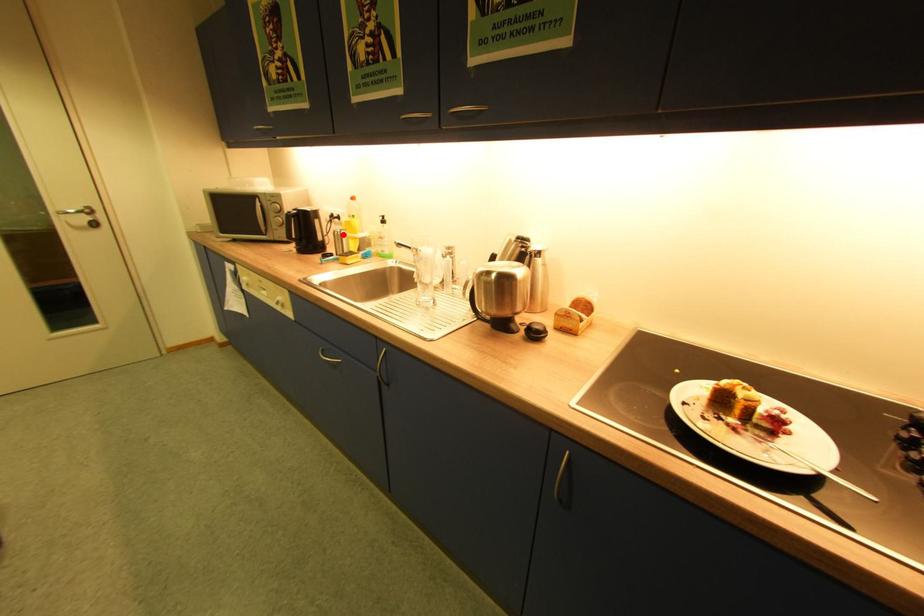
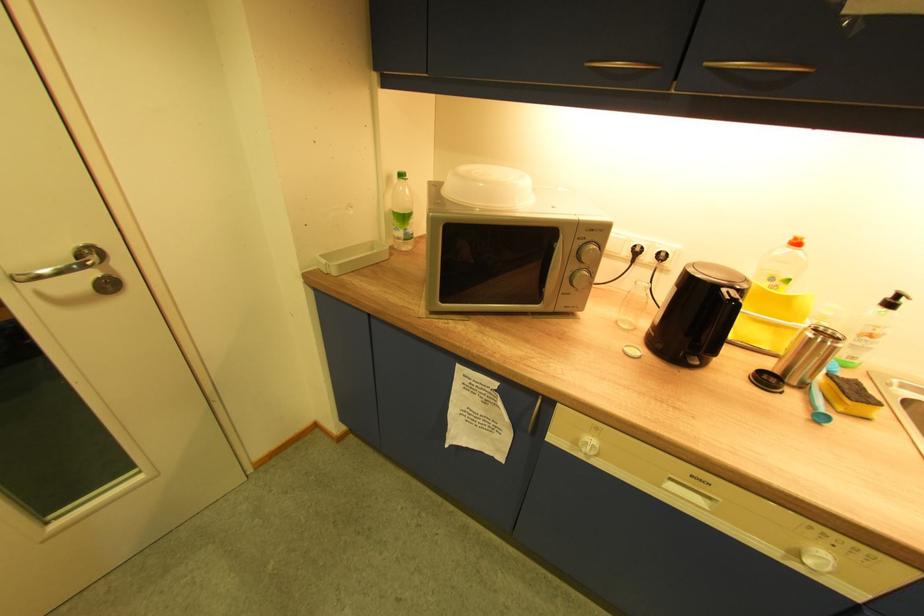
Find the pixel in the second image that matches the highlighted location in the first image.

(830, 342)